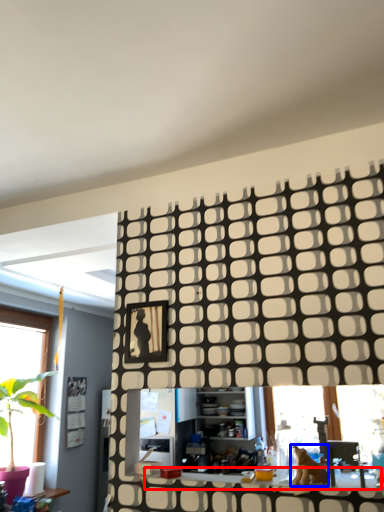
Question: Which point is further to the camera, counter top (highlighted by a red box) or animal (highlighted by a blue box)?

Choices:
 (A) counter top
 (B) animal

Answer: (B)